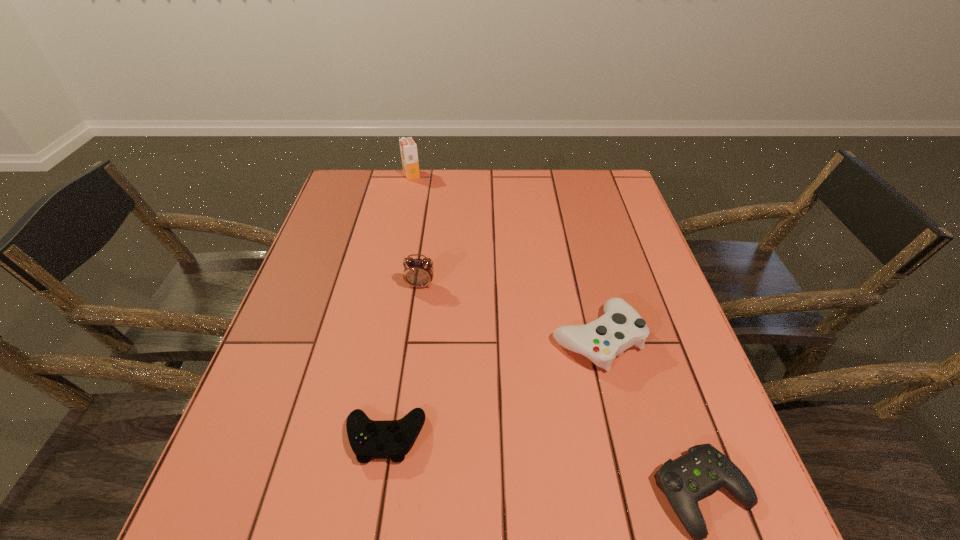
Where is `free spot between the orange juice and the leftmost control`? This screenshot has height=540, width=960. free spot between the orange juice and the leftmost control is located at coordinates (398, 306).

Where is `free space between the orange juice and the tallest control`? The image size is (960, 540). free space between the orange juice and the tallest control is located at coordinates (504, 256).

The width and height of the screenshot is (960, 540). Find the location of `free space between the second tallest object and the third tallest object`. free space between the second tallest object and the third tallest object is located at coordinates (509, 312).

The width and height of the screenshot is (960, 540). Find the location of `vacant region between the farthest object and the leftmost control`. vacant region between the farthest object and the leftmost control is located at coordinates (398, 306).

This screenshot has width=960, height=540. I want to click on vacant space that is in between the orange juice and the third tallest object, so click(504, 256).

At what (x,y) coordinates should I click in order to perform the action: click on free area in between the tallest control and the leftmost control. Please return your answer as a coordinate pair (x, y). The width and height of the screenshot is (960, 540). Looking at the image, I should click on (491, 388).

This screenshot has height=540, width=960. What are the coordinates of `the second closest object relative to the tallest object` in the screenshot? It's located at (621, 327).

You are a GUI agent. You are given a task and a screenshot of the screen. Output one action in this format:
    pyautogui.click(x=<x>, y=<y>)
    Task: Click on the object that is the third nearest to the shortest object
    The width and height of the screenshot is (960, 540).
    Given the screenshot: What is the action you would take?
    pyautogui.click(x=419, y=273)

Find the location of `control that is the second nearest to the farthest control`. control that is the second nearest to the farthest control is located at coordinates (389, 439).

Identify which control is located as the second nearest to the fourth nearest object. Please provide its 2D coordinates. Your answer should be formatted as a tuple, i.e. [(x, y)], where the tuple contains the x and y coordinates of a point satisfying the conditions above.

[(389, 439)]